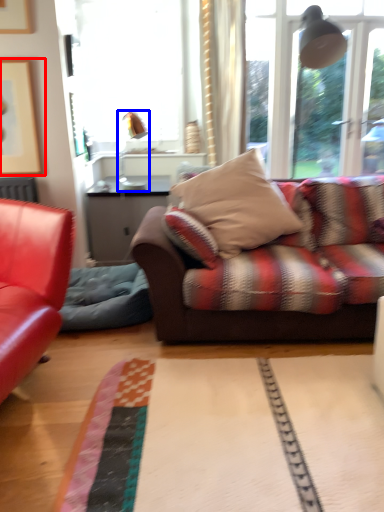
Question: Which of the following is the farthest to the observer, picture frame (highlighted by a red box) or lamp (highlighted by a blue box)?

Choices:
 (A) picture frame
 (B) lamp

Answer: (B)